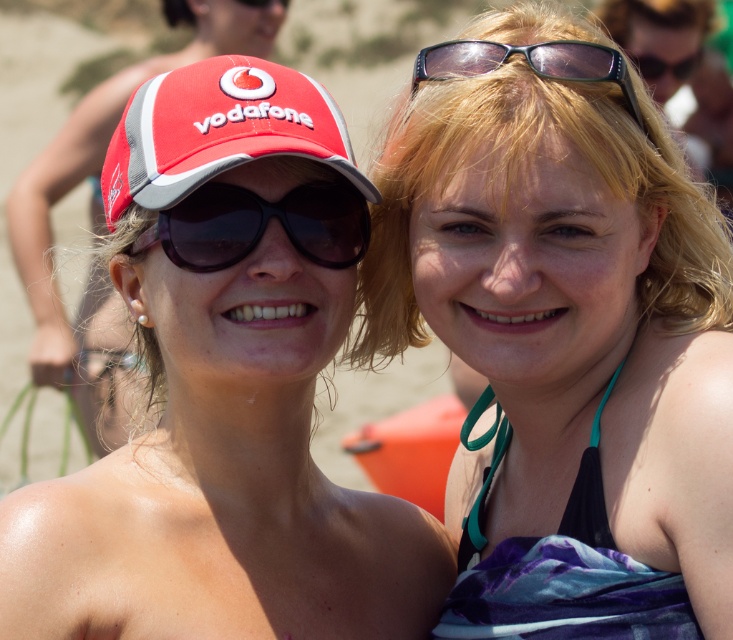
You are standing at the camera position and want to throw a frisbee to the point marked as point (323, 280). Can you reach it with a throw of 7 meters?

The point (323, 280) is 6.88 meters from the camera, so yes, you can reach it with a 7 meter throw.

You are a photographer trying to capture the matte black bikini top at center and the matte red cap at left in a single frame. Based on their positions, which object is closer to the camera?

The matte black bikini top at center is positioned under the matte red cap at left, so the matte red cap at left is closer to the camera since it appears above the bikini top.